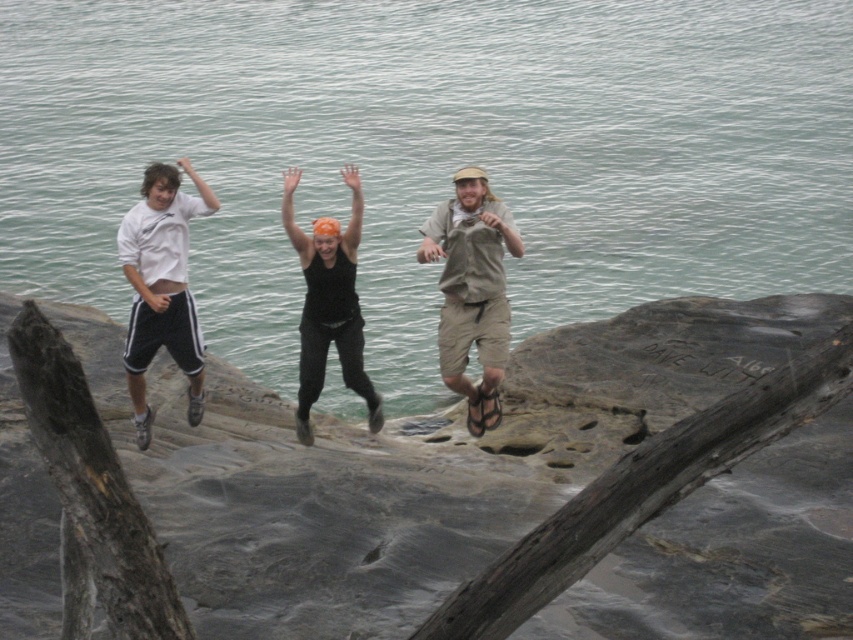
You are a hiker who wants to sit on the gray rough rock at center while wearing the black fabric tank top at center. Will the tank top get in the way when sitting?

The gray rough rock at center is shorter than the black fabric tank top at center. When sitting, the tank top might bunch up or get caught on the rock, so it could be in the way.